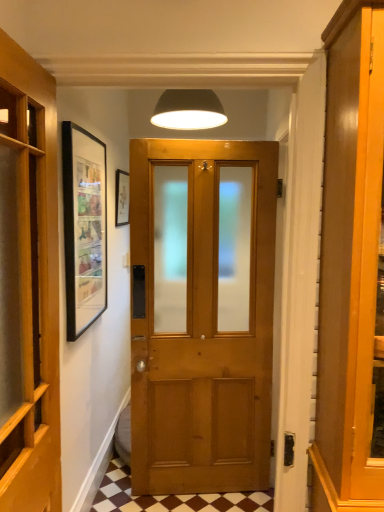
Question: Is brown checkered tile at center thinner than wooden door at left?

Choices:
 (A) yes
 (B) no

Answer: (B)

Question: Is the depth of brown checkered tile at center greater than that of wooden door at left?

Choices:
 (A) yes
 (B) no

Answer: (A)

Question: Is brown checkered tile at center facing towards wooden door at left?

Choices:
 (A) yes
 (B) no

Answer: (B)

Question: Does brown checkered tile at center have a greater height compared to wooden door at left?

Choices:
 (A) no
 (B) yes

Answer: (A)

Question: Considering the relative positions of brown checkered tile at center and wooden door at left in the image provided, is brown checkered tile at center to the right of wooden door at left from the viewer's perspective?

Choices:
 (A) yes
 (B) no

Answer: (A)

Question: Is brown checkered tile at center taller or shorter than white matte lampshade at upper center?

Choices:
 (A) short
 (B) tall

Answer: (A)

Question: In terms of width, does brown checkered tile at center look wider or thinner when compared to white matte lampshade at upper center?

Choices:
 (A) thin
 (B) wide

Answer: (B)

Question: Which is correct: brown checkered tile at center is inside white matte lampshade at upper center, or outside of it?

Choices:
 (A) outside
 (B) inside

Answer: (A)

Question: From the image's perspective, is brown checkered tile at center positioned above or below white matte lampshade at upper center?

Choices:
 (A) above
 (B) below

Answer: (B)

Question: Considering their positions, is brown checkered tile at center located in front of or behind wooden door at left?

Choices:
 (A) behind
 (B) front

Answer: (A)

Question: From the image's perspective, is brown checkered tile at center above or below wooden door at left?

Choices:
 (A) below
 (B) above

Answer: (A)

Question: Is brown checkered tile at center bigger or smaller than wooden door at left?

Choices:
 (A) small
 (B) big

Answer: (A)

Question: From a real-world perspective, is brown checkered tile at center positioned above or below wooden door at left?

Choices:
 (A) below
 (B) above

Answer: (A)

Question: In the image, is white matte lampshade at upper center on the left side or the right side of matte black picture frame at upper left?

Choices:
 (A) left
 (B) right

Answer: (B)

Question: From the image's perspective, relative to matte black picture frame at upper left, is white matte lampshade at upper center above or below?

Choices:
 (A) above
 (B) below

Answer: (A)